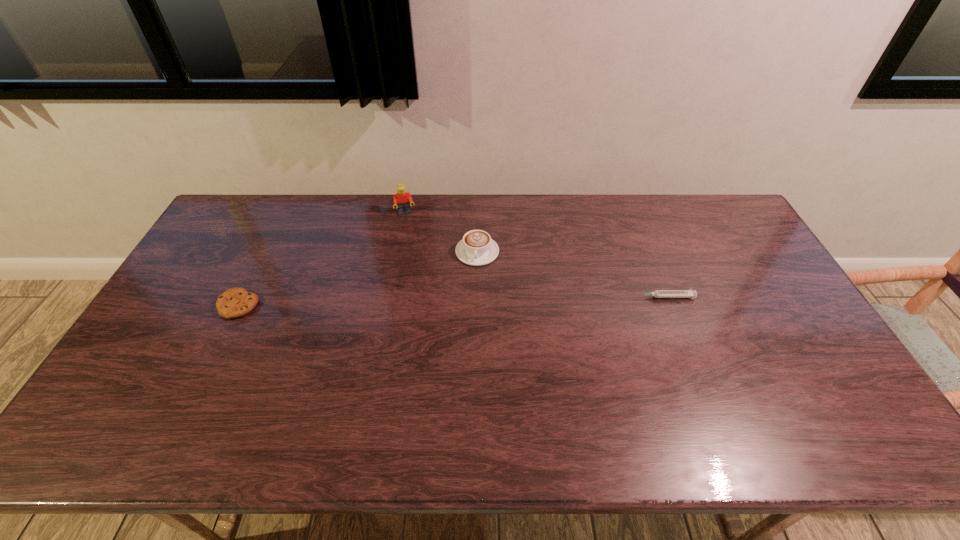
Find the location of a particular element. cookie is located at coordinates (235, 302).

Image resolution: width=960 pixels, height=540 pixels. What are the coordinates of `the shortest object` in the screenshot? It's located at (690, 293).

Image resolution: width=960 pixels, height=540 pixels. In order to click on syringe in this screenshot , I will do `click(690, 293)`.

At what (x,y) coordinates should I click in order to perform the action: click on the second object from right to left. Please return your answer as a coordinate pair (x, y). The height and width of the screenshot is (540, 960). Looking at the image, I should click on (476, 248).

Identify the location of the third nearest object. Image resolution: width=960 pixels, height=540 pixels. (476, 248).

You are a GUI agent. You are given a task and a screenshot of the screen. Output one action in this format:
    pyautogui.click(x=<x>, y=<y>)
    Task: Click on the Lego
    This screenshot has height=540, width=960.
    Given the screenshot: What is the action you would take?
    pyautogui.click(x=403, y=199)

Where is `the farthest object`? the farthest object is located at coordinates (403, 199).

Locate an element on the screen. This screenshot has height=540, width=960. vacant point located 0.300m on the back of the cookie is located at coordinates (276, 228).

This screenshot has height=540, width=960. Identify the location of free point located 0.200m at the needle end of the syringe. (567, 297).

Identify the location of free location located at the needle end of the syringe. This screenshot has width=960, height=540. (551, 297).